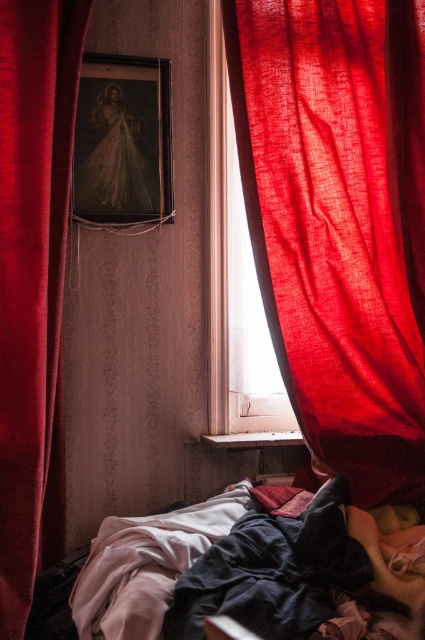
Question: Which of the following is the closest to the observer?

Choices:
 (A) translucent fabric window at center
 (B) matte red curtain at center
 (C) velvet-like red curtain at left

Answer: (C)

Question: Can you confirm if velvet-like red curtain at left is bigger than wooden framed portrait at center?

Choices:
 (A) yes
 (B) no

Answer: (A)

Question: Which of the following is the closest to the observer?

Choices:
 (A) translucent fabric window at center
 (B) dark blue fabric bed at lower center
 (C) wooden framed portrait at center

Answer: (B)

Question: Can you confirm if dark blue fabric bed at lower center is positioned to the left of velvet-like red curtain at left?

Choices:
 (A) no
 (B) yes

Answer: (A)

Question: Does velvet-like red curtain at left appear on the right side of translucent fabric window at center?

Choices:
 (A) no
 (B) yes

Answer: (A)

Question: Which point appears farthest from the camera in this image?

Choices:
 (A) (217, 220)
 (B) (155, 115)
 (C) (34, 520)

Answer: (A)